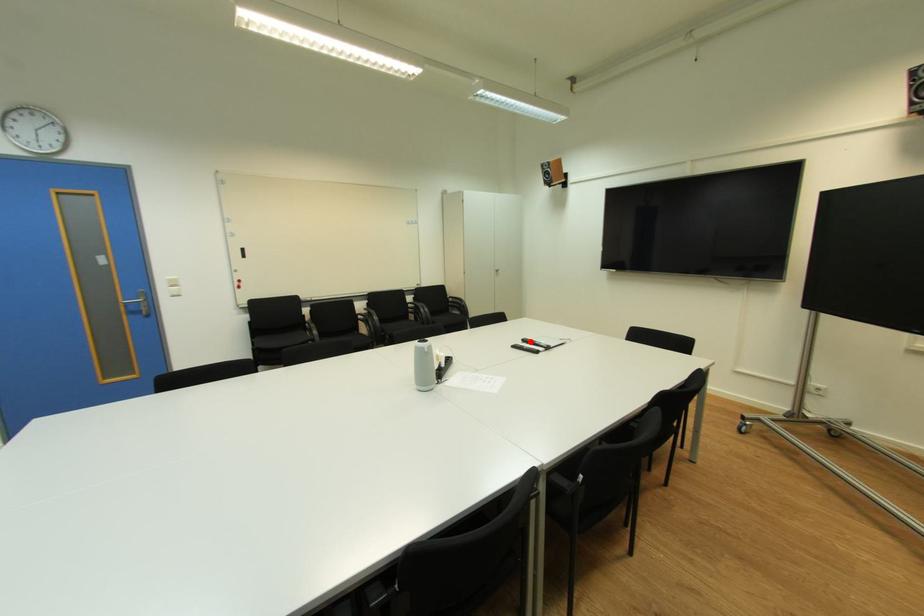
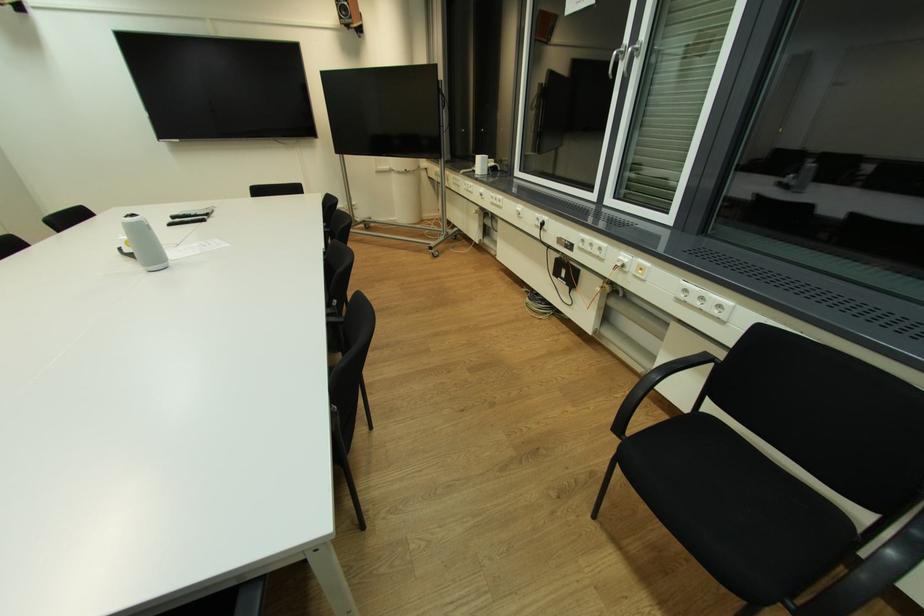
Where in the second image is the point corresponding to the highlighted location from the first image?

(177, 219)